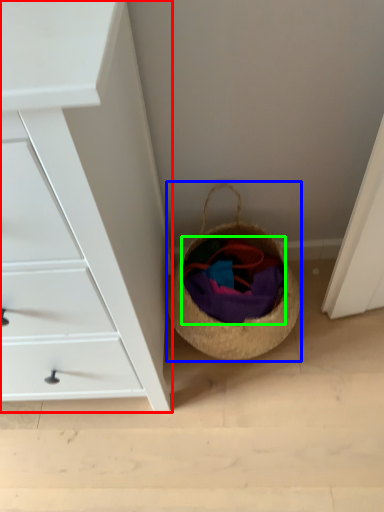
Question: Which object is the closest to the chest of drawers (highlighted by a red box)? Choose among these: basket (highlighted by a blue box) or clothing (highlighted by a green box).

Choices:
 (A) basket
 (B) clothing

Answer: (A)